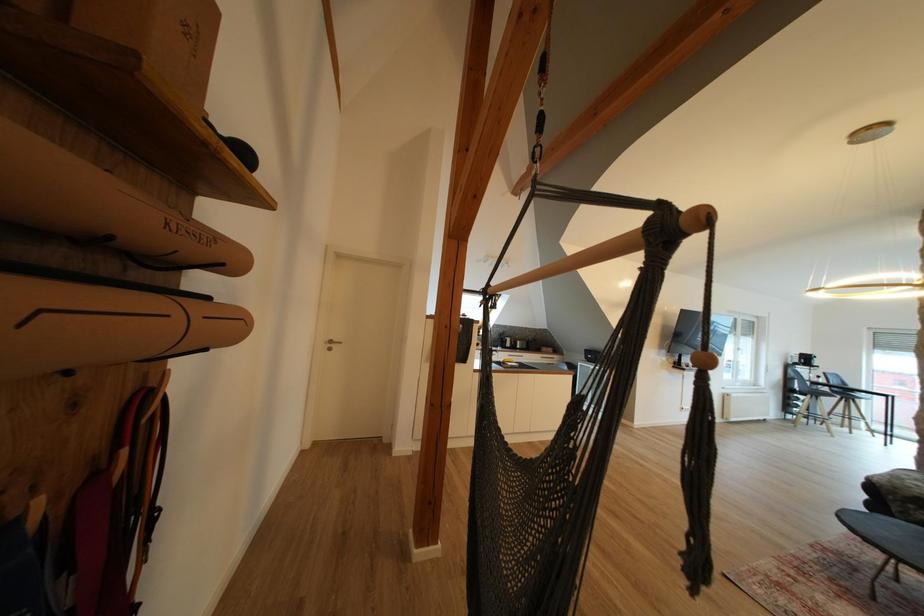
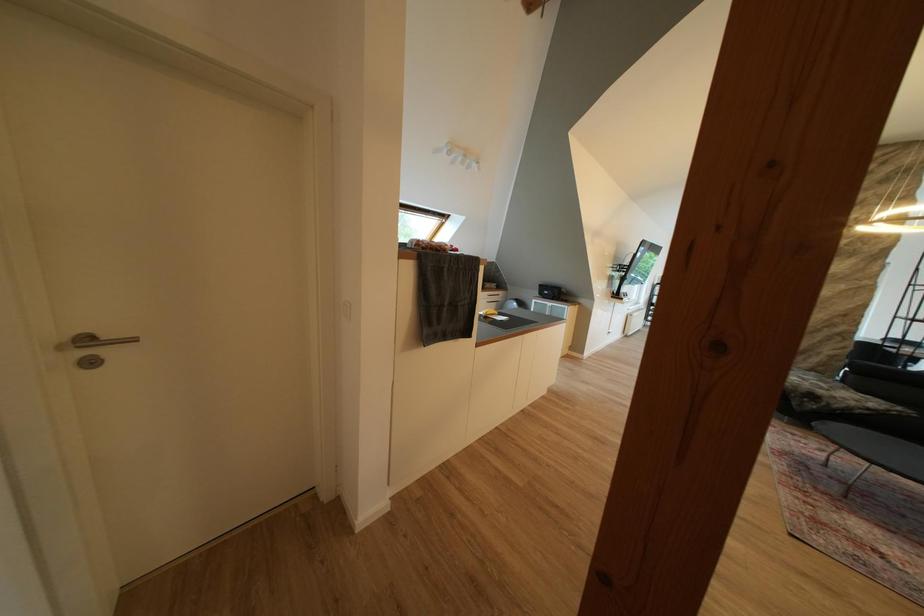
What movement of the cameraman would produce the second image?

The movement direction of the cameraman is left, forward.